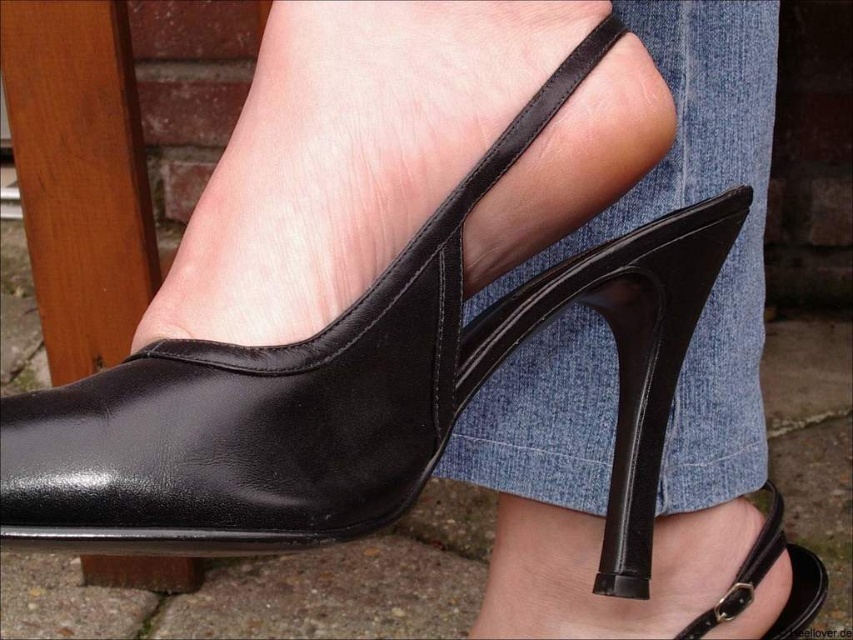
Does black leather shoe at center appear on the right side of black leather high-heeled shoe at center?

In fact, black leather shoe at center is to the left of black leather high-heeled shoe at center.

Does point (74, 512) come closer to viewer compared to point (815, 593)?

That is True.

Does point (310, 508) lie behind point (555, 529)?

No, it is in front of (555, 529).

At what (x,y) coordinates should I click in order to perform the action: click on black leather shoe at center. Please return your answer as a coordinate pair (x, y). Looking at the image, I should click on (296, 371).